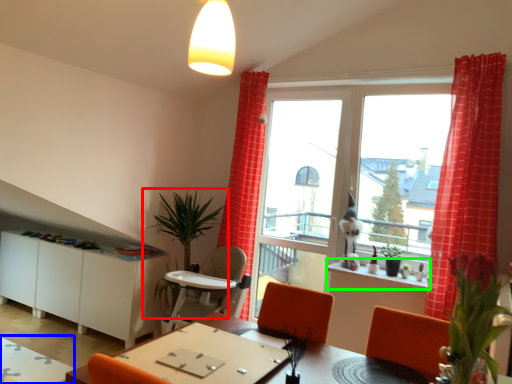
Question: Based on their relative distances, which object is nearer to houseplant (highlighted by a red box)? Choose from table (highlighted by a blue box) and window sill (highlighted by a green box).

Choices:
 (A) table
 (B) window sill

Answer: (B)